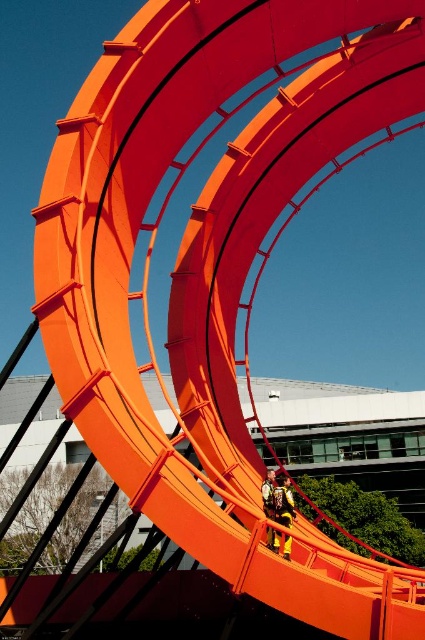
Question: Does yellow fabric at center have a lesser width compared to yellow fabric jacket at center?

Choices:
 (A) yes
 (B) no

Answer: (A)

Question: Is yellow fabric at center above yellow fabric jacket at center?

Choices:
 (A) no
 (B) yes

Answer: (A)

Question: Is yellow fabric at center smaller than yellow fabric jacket at center?

Choices:
 (A) yes
 (B) no

Answer: (A)